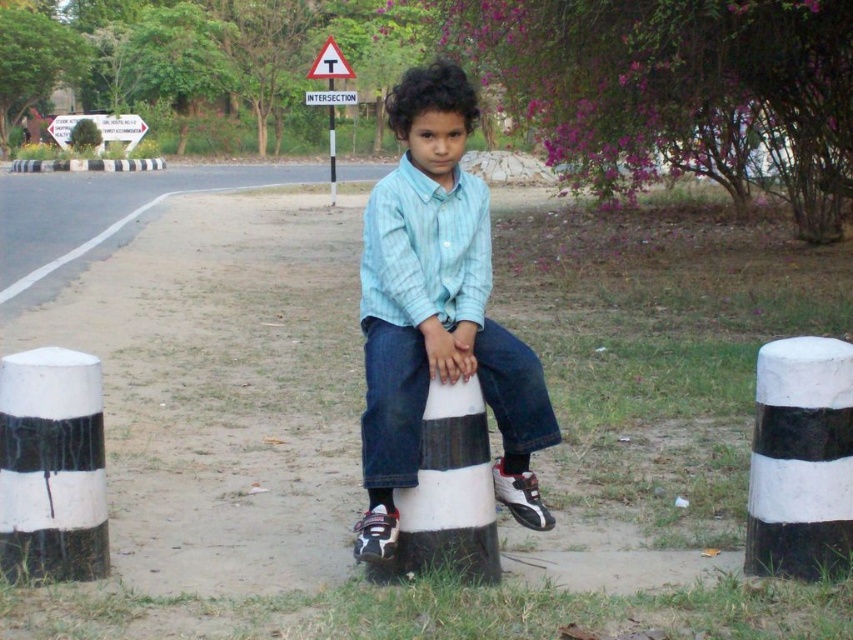
Question: Is white plastic sign at upper center bigger than white striped pole at center?

Choices:
 (A) yes
 (B) no

Answer: (B)

Question: Based on their relative distances, which object is farther from the white plastic sign at upper center?

Choices:
 (A) white plastic triangle at upper center
 (B) light blue denim shirt at center
 (C) black and white striped post at center
 (D) white striped cone at center

Answer: (D)

Question: Among these points, which one is nearest to the camera?

Choices:
 (A) (779, 470)
 (B) (451, 396)

Answer: (B)

Question: Which point is farther to the camera?

Choices:
 (A) (93, 557)
 (B) (341, 58)
 (C) (335, 193)

Answer: (C)

Question: From the image, what is the correct spatial relationship of black and white striped post at lower right in relation to white plastic sign at upper center?

Choices:
 (A) above
 (B) below

Answer: (B)

Question: Does black and white striped post at lower right lie behind white plastic triangle at upper center?

Choices:
 (A) no
 (B) yes

Answer: (A)